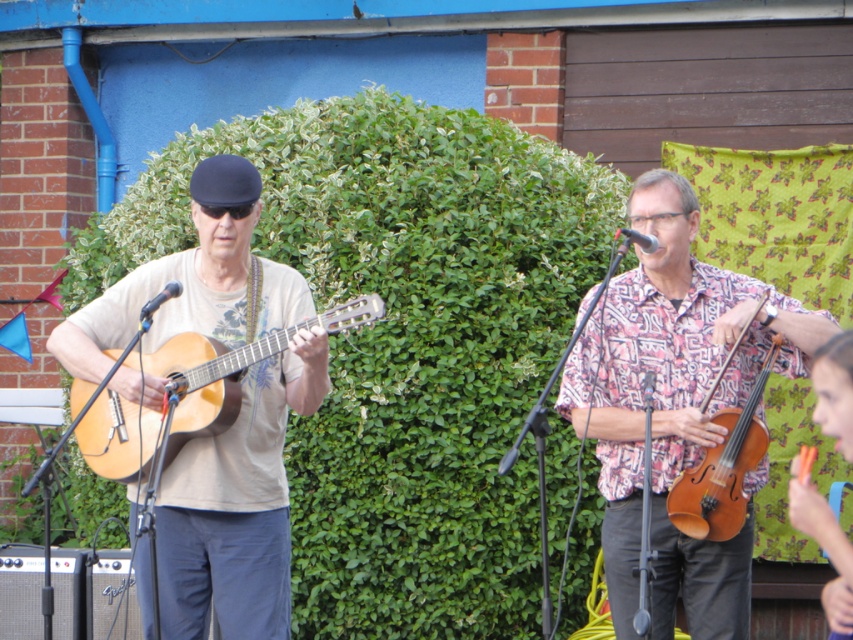
Can you confirm if matte brown guitar at left is shorter than brown wooden violin at center-right?

No, matte brown guitar at left is not shorter than brown wooden violin at center-right.

Can you confirm if matte brown guitar at left is positioned above brown wooden violin at center-right?

Yes.

Image resolution: width=853 pixels, height=640 pixels. I want to click on matte brown guitar at left, so click(x=236, y=506).

The width and height of the screenshot is (853, 640). Find the location of `matte brown guitar at left`. matte brown guitar at left is located at coordinates pos(236,506).

This screenshot has width=853, height=640. What do you see at coordinates (236, 506) in the screenshot? I see `matte brown guitar at left` at bounding box center [236, 506].

Image resolution: width=853 pixels, height=640 pixels. What are the coordinates of `matte brown guitar at left` in the screenshot? It's located at (236, 506).

Identify the location of matte brown guitar at left. The height and width of the screenshot is (640, 853). (236, 506).

Can you confirm if patterned fabric shirt at right is positioned above brown wooden violin at center-right?

Yes.

From the picture: Between patterned fabric shirt at right and brown wooden violin at center-right, which one is positioned lower?

brown wooden violin at center-right is below.

Is point (607, 396) farther from camera compared to point (735, 435)?

That is True.

This screenshot has width=853, height=640. Find the location of `patterned fabric shirt at right`. patterned fabric shirt at right is located at coordinates (660, 413).